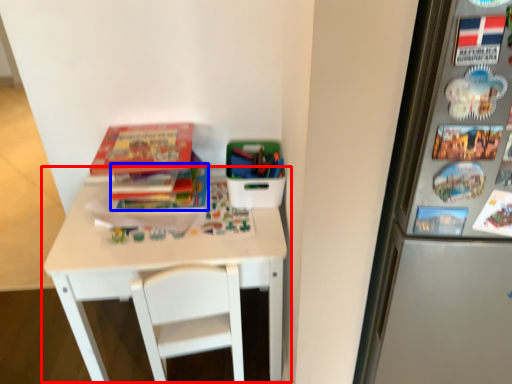
Question: Which of the following is the closest to the observer, table (highlighted by a red box) or book (highlighted by a blue box)?

Choices:
 (A) table
 (B) book

Answer: (A)